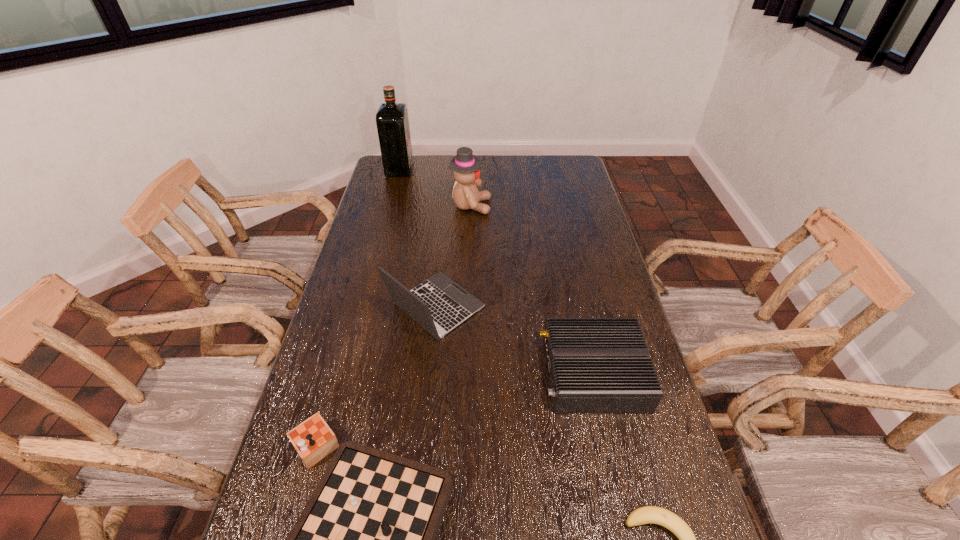
The width and height of the screenshot is (960, 540). In order to click on liquor in this screenshot , I will do `click(392, 121)`.

Locate an element on the screen. The image size is (960, 540). the farthest object is located at coordinates (392, 121).

The image size is (960, 540). Find the location of `the second tallest object`. the second tallest object is located at coordinates point(465,165).

Find the location of `rag_doll`. rag_doll is located at coordinates (465, 165).

Identify the location of laptop_computer. (439, 304).

The height and width of the screenshot is (540, 960). In order to click on router in this screenshot , I will do `click(596, 365)`.

The height and width of the screenshot is (540, 960). What are the coordinates of `vacant space positioned on the front label of the farthest object` in the screenshot? It's located at (493, 169).

Find the location of a particular element. Image resolution: width=960 pixels, height=540 pixels. free space located on the front-facing side of the rag_doll is located at coordinates (573, 206).

Locate an element on the screen. The height and width of the screenshot is (540, 960). vacant region located at the front screen of the fourth shortest object is located at coordinates (564, 307).

You are a GUI agent. You are given a task and a screenshot of the screen. Output one action in this format:
    pyautogui.click(x=<x>, y=<y>)
    Task: Click on the vacant area located 0.070m on the back panel of the router
    The height and width of the screenshot is (540, 960).
    Given the screenshot: What is the action you would take?
    pyautogui.click(x=516, y=373)